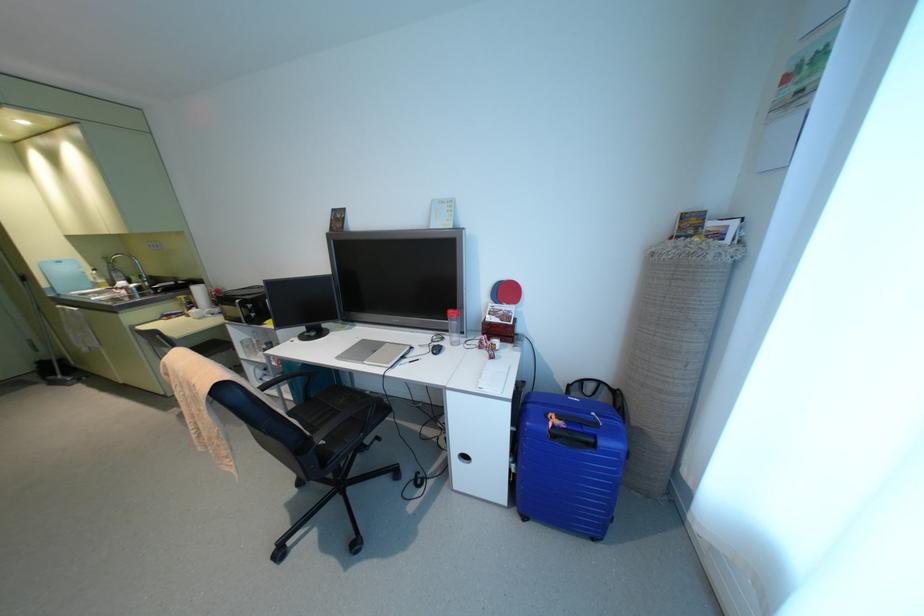
At what (x,y) coordinates should I click in order to perform the action: click on blue cutting board. Please return your answer as a coordinate pair (x, y). Looking at the image, I should click on (570, 459).